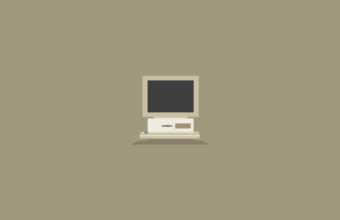
This screenshot has width=340, height=220. Identify the location of base computer monitor. (156, 123).